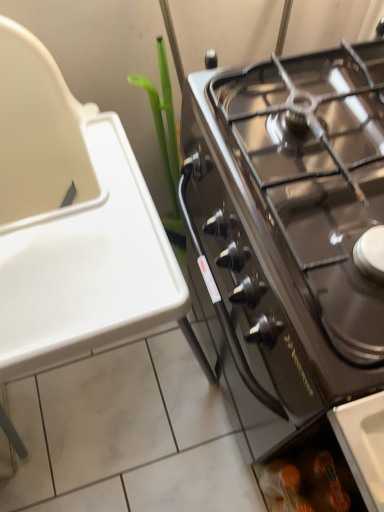
Question: From a real-world perspective, is black glass gas stove at right positioned under translucent plastic bag at lower right based on gravity?

Choices:
 (A) no
 (B) yes

Answer: (A)

Question: Does black glass gas stove at right have a greater height compared to translucent plastic bag at lower right?

Choices:
 (A) yes
 (B) no

Answer: (B)

Question: From a real-world perspective, is black glass gas stove at right over translucent plastic bag at lower right?

Choices:
 (A) no
 (B) yes

Answer: (B)

Question: Is black glass gas stove at right positioned before translucent plastic bag at lower right?

Choices:
 (A) yes
 (B) no

Answer: (A)

Question: Is black glass gas stove at right to the left of translucent plastic bag at lower right from the viewer's perspective?

Choices:
 (A) yes
 (B) no

Answer: (A)

Question: From the image's perspective, would you say black glass gas stove at right is positioned over translucent plastic bag at lower right?

Choices:
 (A) yes
 (B) no

Answer: (A)

Question: Is translucent plastic bag at lower right further to camera compared to green plastic plant at upper left?

Choices:
 (A) no
 (B) yes

Answer: (B)

Question: Would you say translucent plastic bag at lower right contains green plastic plant at upper left?

Choices:
 (A) no
 (B) yes

Answer: (A)

Question: Does translucent plastic bag at lower right lie in front of green plastic plant at upper left?

Choices:
 (A) no
 (B) yes

Answer: (A)

Question: Considering the relative sizes of translucent plastic bag at lower right and green plastic plant at upper left in the image provided, is translucent plastic bag at lower right smaller than green plastic plant at upper left?

Choices:
 (A) no
 (B) yes

Answer: (B)

Question: Is translucent plastic bag at lower right facing away from green plastic plant at upper left?

Choices:
 (A) yes
 (B) no

Answer: (B)

Question: Could you tell me if translucent plastic bag at lower right is turned towards green plastic plant at upper left?

Choices:
 (A) no
 (B) yes

Answer: (A)

Question: Is black glass gas stove at right to the right of green plastic plant at upper left from the viewer's perspective?

Choices:
 (A) yes
 (B) no

Answer: (A)